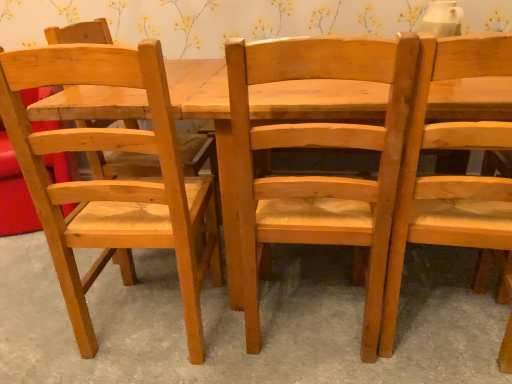
Question: Can you confirm if natural wood chair at right, the 3th chair viewed from the left, is taller than natural wood chair at center?

Choices:
 (A) no
 (B) yes

Answer: (B)

Question: Can you confirm if natural wood chair at right, the 1th chair from the right, is thinner than natural wood chair at center?

Choices:
 (A) yes
 (B) no

Answer: (A)

Question: From a real-world perspective, is natural wood chair at right, the 1th chair from the right, over natural wood chair at center?

Choices:
 (A) no
 (B) yes

Answer: (B)

Question: Can you confirm if natural wood chair at right, the 1th chair from the right, is bigger than natural wood chair at center?

Choices:
 (A) yes
 (B) no

Answer: (A)

Question: Is natural wood chair at right, the 1th chair from the right, located outside natural wood chair at center?

Choices:
 (A) yes
 (B) no

Answer: (A)

Question: Is natural wood chair at right, the 1th chair from the right, oriented towards natural wood chair at center?

Choices:
 (A) no
 (B) yes

Answer: (A)

Question: Can you confirm if natural wood chair at center, marked as the second chair in a right-to-left arrangement, is shorter than natural wood chair at right, the 3th chair viewed from the left?

Choices:
 (A) yes
 (B) no

Answer: (A)

Question: From the image's perspective, is natural wood chair at center, which is the second chair from left to right, under natural wood chair at right, the 3th chair viewed from the left?

Choices:
 (A) yes
 (B) no

Answer: (B)

Question: Considering the relative sizes of natural wood chair at center, marked as the second chair in a right-to-left arrangement, and natural wood chair at right, the 1th chair from the right, in the image provided, is natural wood chair at center, marked as the second chair in a right-to-left arrangement, smaller than natural wood chair at right, the 1th chair from the right,?

Choices:
 (A) no
 (B) yes

Answer: (A)

Question: Is natural wood chair at center, marked as the second chair in a right-to-left arrangement, positioned in front of natural wood chair at right, the 3th chair viewed from the left?

Choices:
 (A) yes
 (B) no

Answer: (B)

Question: Is natural wood chair at center, which is the second chair from left to right, further to camera compared to natural wood chair at right, the 3th chair viewed from the left?

Choices:
 (A) no
 (B) yes

Answer: (B)

Question: Is natural wood chair at center, marked as the second chair in a right-to-left arrangement, next to natural wood chair at right, the 1th chair from the right, and touching it?

Choices:
 (A) yes
 (B) no

Answer: (B)

Question: Is the depth of natural wood chair at center, marked as the second chair in a right-to-left arrangement, greater than that of natural wood chair at center?

Choices:
 (A) yes
 (B) no

Answer: (B)